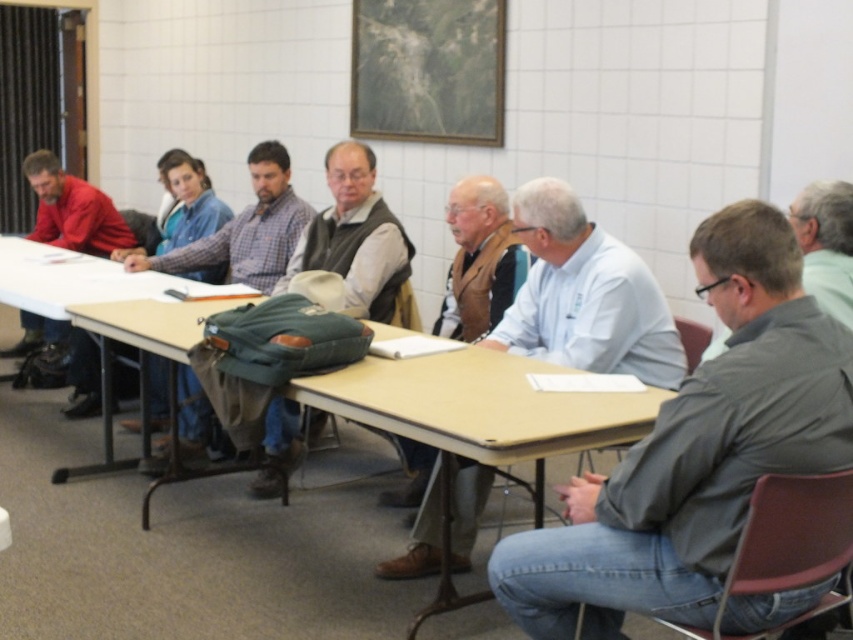
You are an attendee at this meeting. You need to hand a document to the person wearing the light blue shirt at center and the person wearing the gray matte shirt at right. Which person is sitting closer to the front of the room?

The light blue shirt at center is located below gray matte shirt at right, meaning they are sitting closer to the front of the room compared to the gray matte shirt at right.

From the picture: You are standing at the entrance of the meeting room and see the light blue shirt at center and the gray matte shirt at right. Which person is closer to you?

The light blue shirt at center is closer to you because it is further to the viewer than the gray matte shirt at right.

You are organizing a workshop and need to place a name tag on the table between the matte green backpack at center and the green fabric backpack at center. Which backpack should you place it closer to if you want the name tag to be on the left side of the table?

The matte green backpack at center is on the right side of the green fabric backpack at center. To place the name tag on the left side of the table, position it closer to the green fabric backpack at center since it is on the left side of the matte green backpack at center.